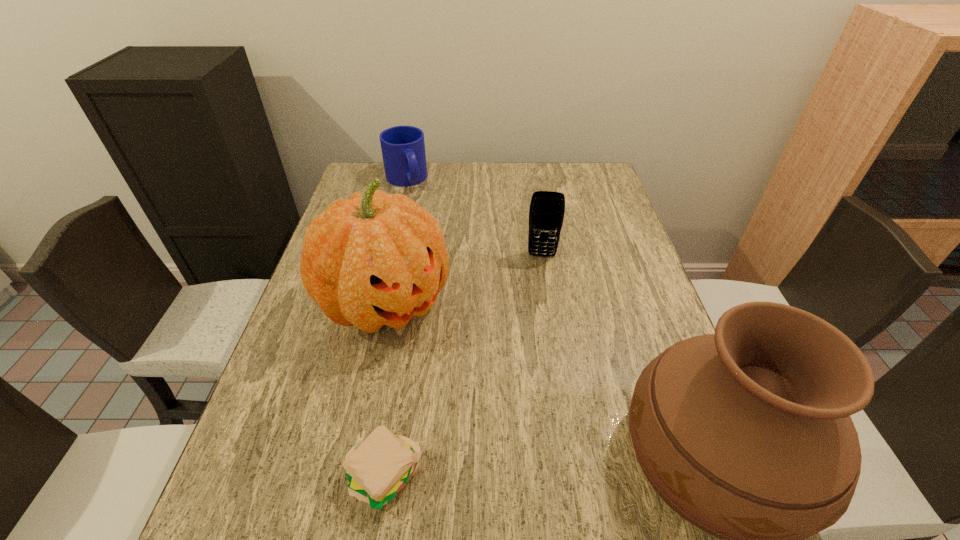
Find the location of `free spot on the desktop that is between the patty and the rightmost object and is positioned on the screen of the third tallest object`. free spot on the desktop that is between the patty and the rightmost object and is positioned on the screen of the third tallest object is located at coordinates (539, 467).

This screenshot has width=960, height=540. In order to click on free space on the desktop that is between the patty and the urn and is positioned on the carved face of the pumpkin in this screenshot , I will do `click(550, 466)`.

The image size is (960, 540). I want to click on free space on the desktop that is between the shortest object and the rightmost object and is positioned on the side with the handle of the farthest object, so click(x=561, y=465).